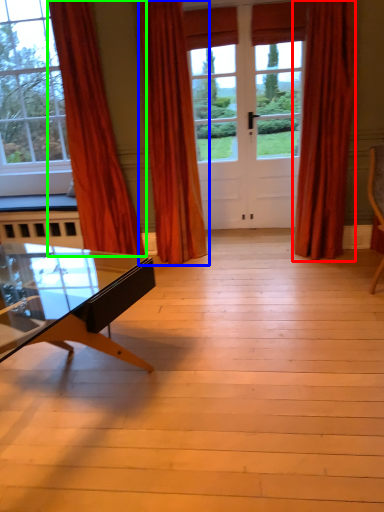
Question: Considering the real-world distances, which object is closest to curtain (highlighted by a red box)? curtain (highlighted by a blue box) or curtain (highlighted by a green box).

Choices:
 (A) curtain
 (B) curtain

Answer: (A)